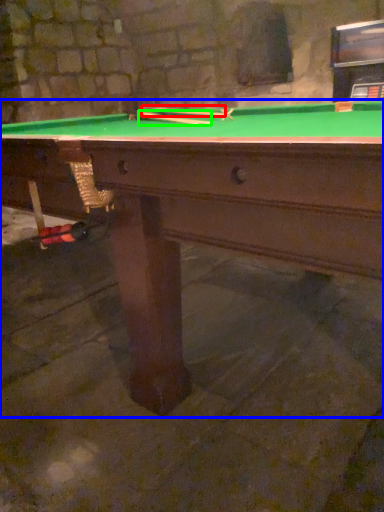
Question: Estimate the real-world distances between objects in this image. Which object is farther from cue (highlighted by a red box), billiard table (highlighted by a blue box) or cue (highlighted by a green box)?

Choices:
 (A) billiard table
 (B) cue

Answer: (A)